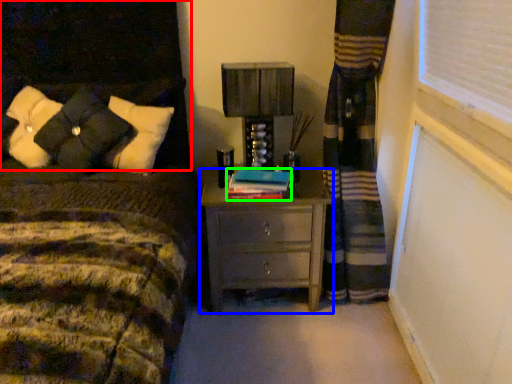
Question: Which object is the closest to the headboard (highlighted by a red box)? Choose among these: nightstand (highlighted by a blue box) or book (highlighted by a green box).

Choices:
 (A) nightstand
 (B) book

Answer: (B)